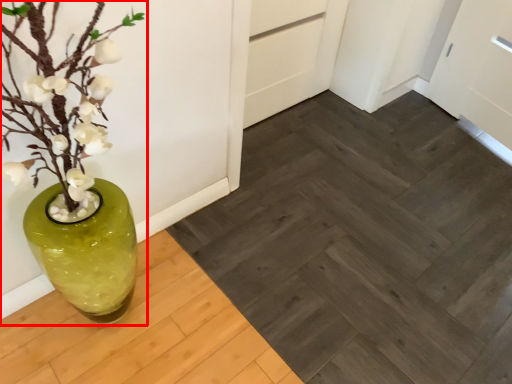
Question: Where is houseplant (annotated by the red box) located in relation to plank in the image?

Choices:
 (A) right
 (B) left

Answer: (B)